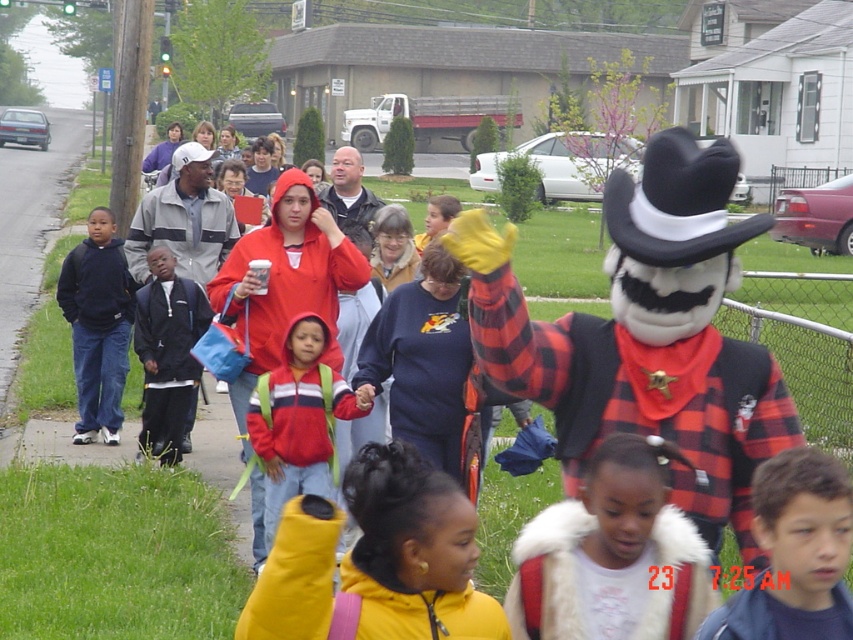
Who is higher up, blue denim jacket at lower right or matte black hoodie at left?

Positioned higher is matte black hoodie at left.

I want to click on blue denim jacket at lower right, so click(x=793, y=554).

From the picture: Does black felt cowboy hat at right appear on the left side of dark blue jacket at left?

No, black felt cowboy hat at right is not to the left of dark blue jacket at left.

Where is `black felt cowboy hat at right`? black felt cowboy hat at right is located at coordinates [646, 336].

Can you confirm if black felt cowboy hat at right is shorter than blue denim jacket at lower right?

No, black felt cowboy hat at right is not shorter than blue denim jacket at lower right.

Does point (532, 344) lie behind point (776, 474)?

Yes, point (532, 344) is behind point (776, 474).

Describe the element at coordinates (646, 336) in the screenshot. Image resolution: width=853 pixels, height=640 pixels. I see `black felt cowboy hat at right` at that location.

You are a GUI agent. You are given a task and a screenshot of the screen. Output one action in this format:
    pyautogui.click(x=<x>, y=<y>)
    Task: Click on the black felt cowboy hat at right
    This screenshot has width=853, height=640.
    Given the screenshot: What is the action you would take?
    pyautogui.click(x=646, y=336)